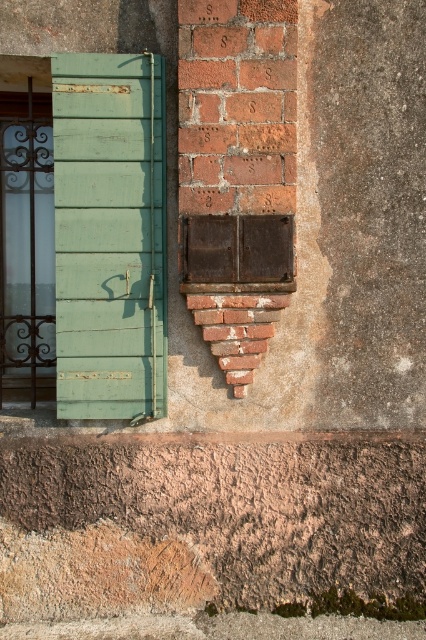
You are an architect designing a new facade and want to incorporate elements from this scene. If you need to place a wider decorative element between the green painted wood at left and the rusty metal window at center, which object should you place it next to?

The green painted wood at left is thinner than the rusty metal window at center, so you should place the wider decorative element next to the rusty metal window at center to maintain balance.

You are standing in front of the building and notice two points on the wall. One is at point (166, 372) and the other at point (201, 276). Which point is closer to you?

Point (166, 372) is further to the viewer than point (201, 276), so the point at (201, 276) is closer to you.

From the picture: You are an architect analyzing the building exterior. You notice a point marked at coordinates (x=109, y=236). Based on the scene description, what material does this point correspond to?

The point at coordinates (x=109, y=236) corresponds to green painted wood at left, as indicated by the description.